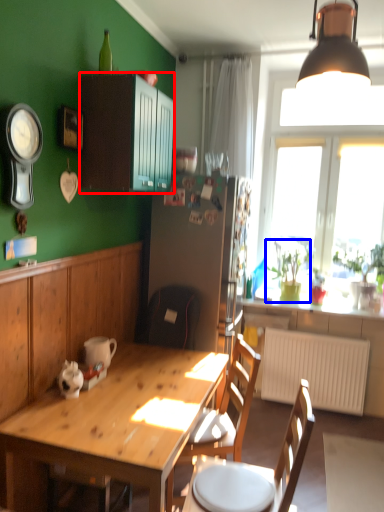
Question: Which object is further to the camera taking this photo, cabinetry (highlighted by a red box) or houseplant (highlighted by a blue box)?

Choices:
 (A) cabinetry
 (B) houseplant

Answer: (B)